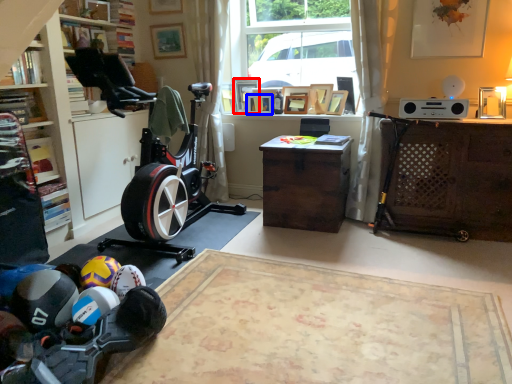
Question: Which of the following is the farthest to the observer, picture frame (highlighted by a red box) or picture frame (highlighted by a blue box)?

Choices:
 (A) picture frame
 (B) picture frame

Answer: (A)